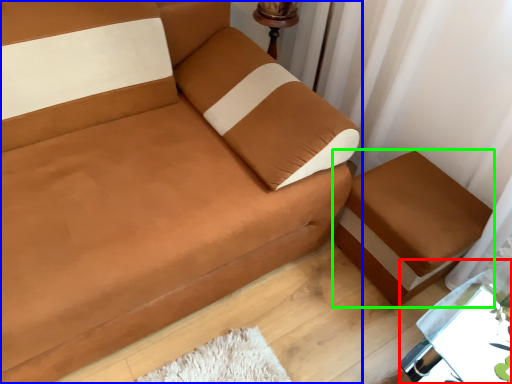
Question: Which object is the closest to the table (highlighted by a red box)? Choose among these: studio couch (highlighted by a blue box) or furniture (highlighted by a green box).

Choices:
 (A) studio couch
 (B) furniture

Answer: (B)